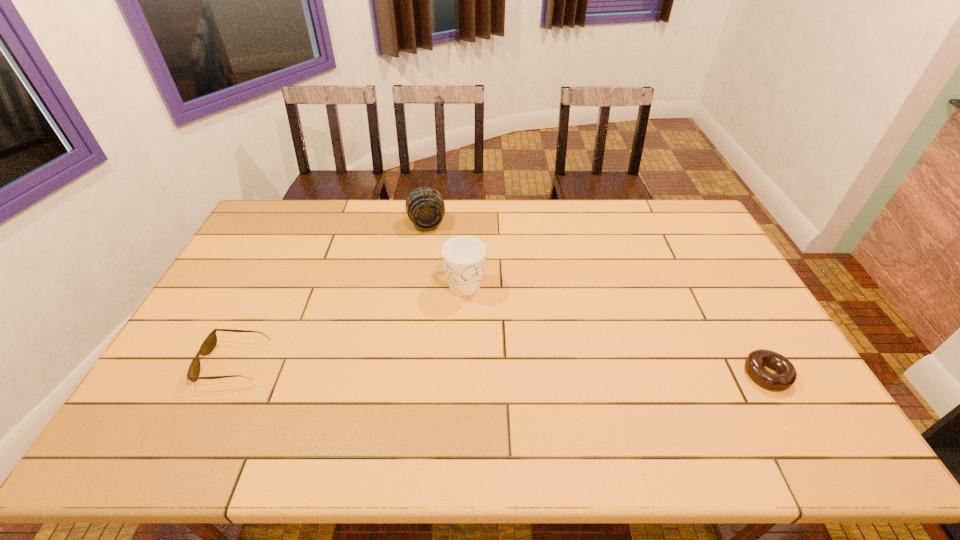
You are a GUI agent. You are given a task and a screenshot of the screen. Output one action in this format:
    pyautogui.click(x=<x>, y=<y>)
    Task: Click on the object located at the near left corner
    
    Given the screenshot: What is the action you would take?
    pyautogui.click(x=208, y=345)

At what (x,y) coordinates should I click in order to perform the action: click on object that is at the near right corner. Please return your answer as a coordinate pair (x, y). The height and width of the screenshot is (540, 960). Looking at the image, I should click on (786, 375).

Find the location of `free space at the far edge of the desktop`. free space at the far edge of the desktop is located at coordinates (442, 233).

Locate an element on the screen. free space at the near edge is located at coordinates (521, 402).

Locate an element on the screen. vacant region at the left edge is located at coordinates (262, 284).

This screenshot has width=960, height=540. What are the coordinates of `vacant space at the far right corner of the desktop` in the screenshot? It's located at (661, 204).

This screenshot has width=960, height=540. In order to click on vacant space at the near right corner in this screenshot , I will do `click(769, 397)`.

Locate an element on the screen. The height and width of the screenshot is (540, 960). empty space between the third object from right to left and the sunglasses is located at coordinates (330, 293).

The height and width of the screenshot is (540, 960). In order to click on free area in between the second object from left to right and the doughnut in this screenshot , I will do `click(596, 299)`.

Locate an element on the screen. free space between the telephoto lens and the doughnut is located at coordinates (596, 299).